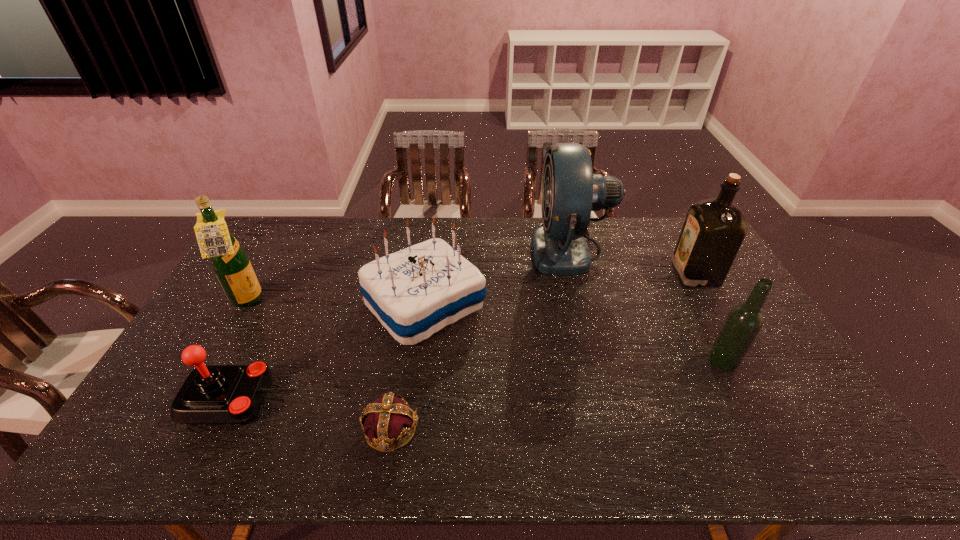
Where is `the third object from right to left`? the third object from right to left is located at coordinates (570, 191).

At what (x,y) coordinates should I click in order to perform the action: click on the leftmost liquor. Please return your answer as a coordinate pair (x, y). Looking at the image, I should click on (230, 262).

Find the location of a particular element. the shortest liquor is located at coordinates (743, 323).

In order to click on birthday cake in this screenshot , I will do `click(415, 292)`.

This screenshot has height=540, width=960. What are the coordinates of `the sixth tallest object` in the screenshot? It's located at (214, 394).

The height and width of the screenshot is (540, 960). I want to click on crown, so click(389, 419).

Where is `free point located 0.210m in front of the third object from right to left to blow air`? The height and width of the screenshot is (540, 960). free point located 0.210m in front of the third object from right to left to blow air is located at coordinates (475, 249).

The image size is (960, 540). I want to click on vacant space situated 0.300m in front of the third object from right to left to blow air, so pos(450,249).

At what (x,y) coordinates should I click in order to perform the action: click on free space located 0.170m in front of the third object from right to left to blow air. Please return your answer as a coordinate pair (x, y). Image resolution: width=960 pixels, height=540 pixels. Looking at the image, I should click on (486, 249).

Where is `vacant area situated 0.380m on the front-facing side of the leftmost liquor`? This screenshot has height=540, width=960. vacant area situated 0.380m on the front-facing side of the leftmost liquor is located at coordinates [382, 302].